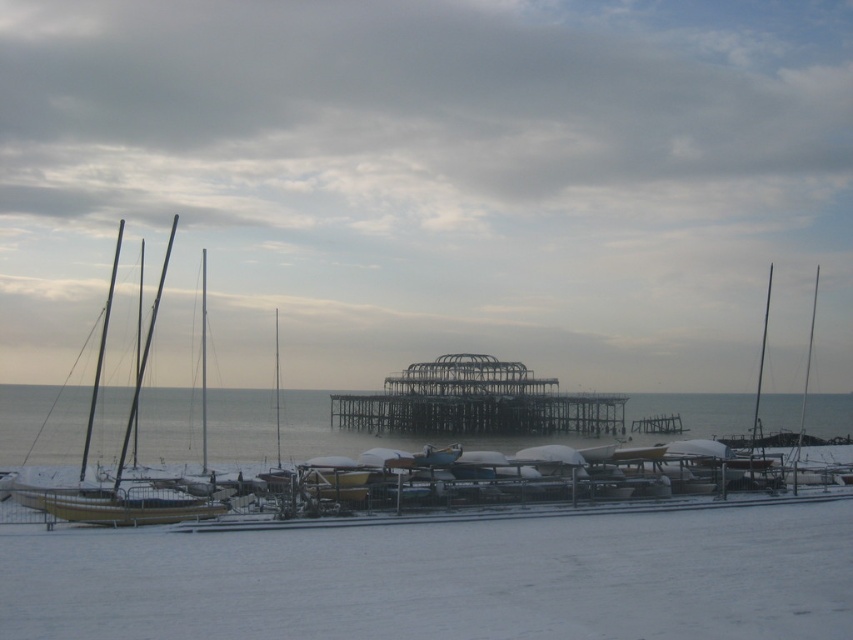
In the scene shown: You are a marine engineer inspecting the marina. You notice the metallic gray pier at center. Based on its coordinates, is it positioned closer to the left or right side of the image?

The metallic gray pier at center is located at point 0.647 on the x axis, which means it is positioned closer to the right side of the image.

You are a photographer planning to take a photo of the wooden sailboat at left and the white matte snow at center. If you want to frame both elements in the same shot, which direction should you move your camera to ensure both are visible?

Since the white matte snow at center is to the right of the wooden sailboat at left, you should move your camera to the left to include both the wooden sailboat at left and the white matte snow at center in the frame.